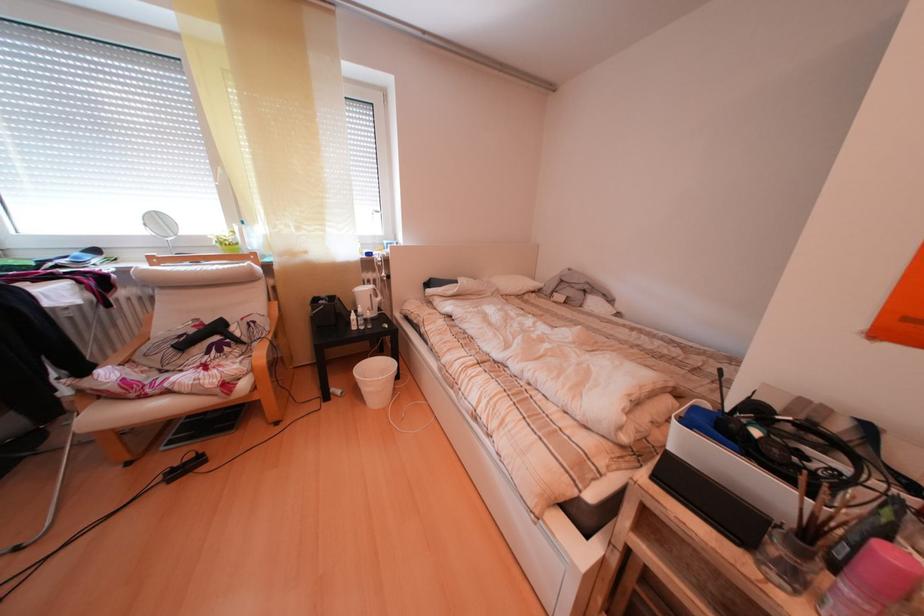
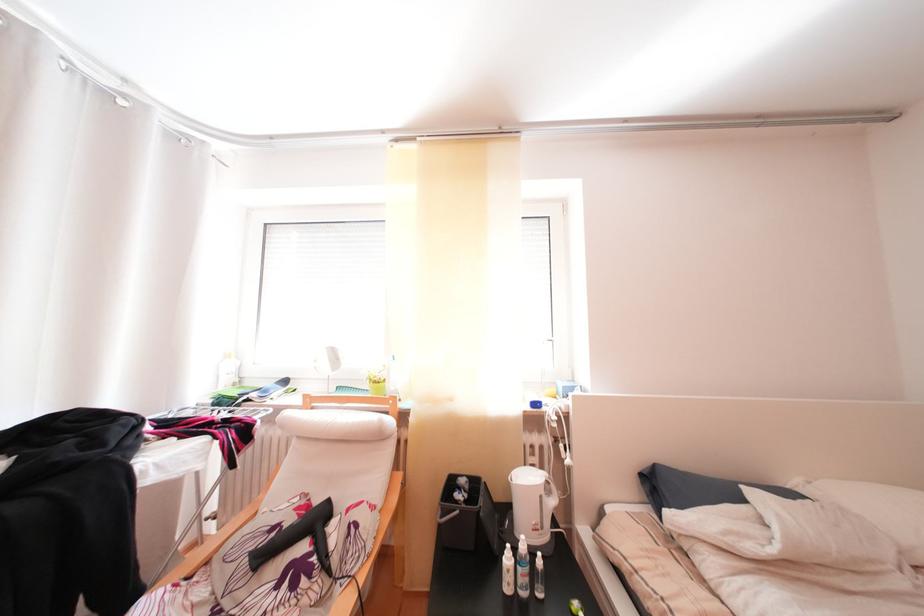
Where in the second image is the point corresponding to pixel 335 301 from the first image?

(475, 487)